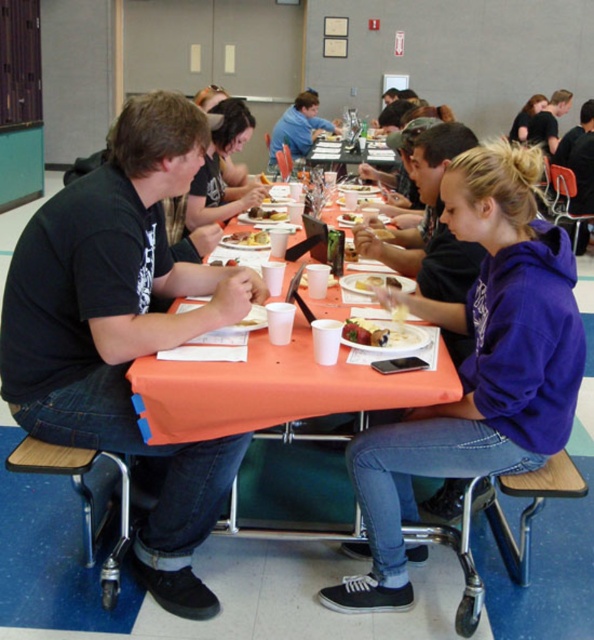
Question: Does blue denim jeans at center appear over smooth white plate at center?

Choices:
 (A) yes
 (B) no

Answer: (A)

Question: Which point is closer to the camera?

Choices:
 (A) purple fleece sweatshirt at center
 (B) black matte shirt at left

Answer: (A)

Question: Is orange fabric table at center wider than orange plastic table at center?

Choices:
 (A) yes
 (B) no

Answer: (A)

Question: Which of the following is the closest to the observer?

Choices:
 (A) orange plastic table at center
 (B) smooth white plate at center

Answer: (B)

Question: Can you confirm if purple fleece sweatshirt at center is bigger than orange plastic table at center?

Choices:
 (A) yes
 (B) no

Answer: (B)

Question: Among these objects, which one is nearest to the camera?

Choices:
 (A) blue denim jeans at center
 (B) black matte shirt at left

Answer: (B)